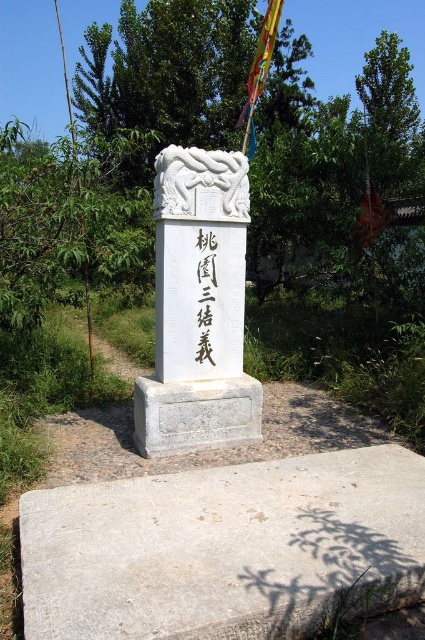
Is point (376, 611) farther from camera compared to point (209, 444)?

That is False.

Is gray concrete at lower center to the right of white stone monument at center from the viewer's perspective?

Yes, gray concrete at lower center is to the right of white stone monument at center.

Who is more distant from viewer, (x=399, y=524) or (x=164, y=445)?

The point (x=164, y=445) is more distant.

You are a GUI agent. You are given a task and a screenshot of the screen. Output one action in this format:
    pyautogui.click(x=<x>, y=<y>)
    Task: Click on the gray concrete at lower center
    
    Given the screenshot: What is the action you would take?
    pyautogui.click(x=224, y=548)

Between gray stone base at center and black stone writing at center, which one is positioned lower?

gray stone base at center is lower down.

Is point (252, 384) in front of point (210, 296)?

No, it is behind (210, 296).

Is point (161, 412) farther from viewer compared to point (215, 275)?

No.

Locate an element on the screen. Image resolution: width=425 pixels, height=640 pixels. gray stone base at center is located at coordinates [x=195, y=413].

Between white stone monument at center and black stone writing at center, which one is positioned lower?

Positioned lower is white stone monument at center.

Identify the location of white stone monument at center. This screenshot has height=640, width=425. (198, 307).

Identify the location of white stone monument at center. The width and height of the screenshot is (425, 640). (198, 307).